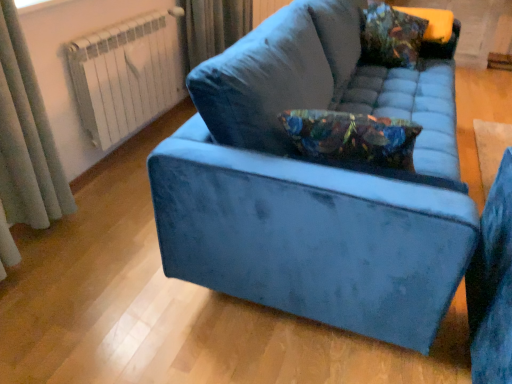
Image resolution: width=512 pixels, height=384 pixels. What are the coordinates of `vacant space underneath white metal radiator at upper left (from a real-world perspective)` in the screenshot? It's located at (145, 142).